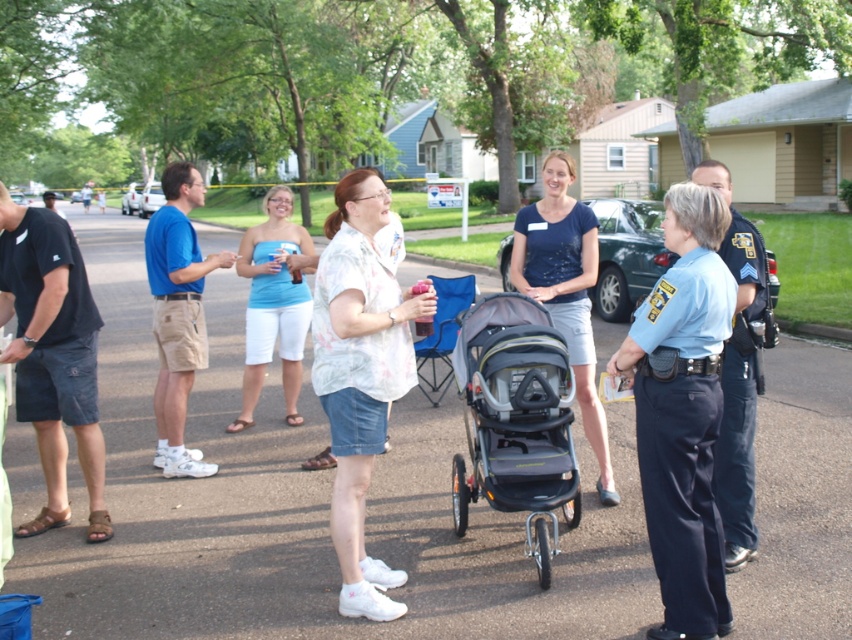
Question: Is blue fabric shirt at left behind dark blue jersey at center?

Choices:
 (A) yes
 (B) no

Answer: (A)

Question: Which point is farther to the camera?

Choices:
 (A) gray fabric stroller at center
 (B) floral shirt at center

Answer: (A)

Question: Can you confirm if floral shirt at center is positioned above dark blue jersey at center?

Choices:
 (A) no
 (B) yes

Answer: (A)

Question: Can you confirm if gray fabric stroller at center is positioned to the left of matte blue tank top at center?

Choices:
 (A) yes
 (B) no

Answer: (B)

Question: Which point is closer to the camera?

Choices:
 (A) (568, 280)
 (B) (343, 588)

Answer: (B)

Question: Which of the following is the closest to the observer?

Choices:
 (A) (291, 246)
 (B) (341, 420)
 (C) (514, 257)
 (D) (199, 177)

Answer: (B)